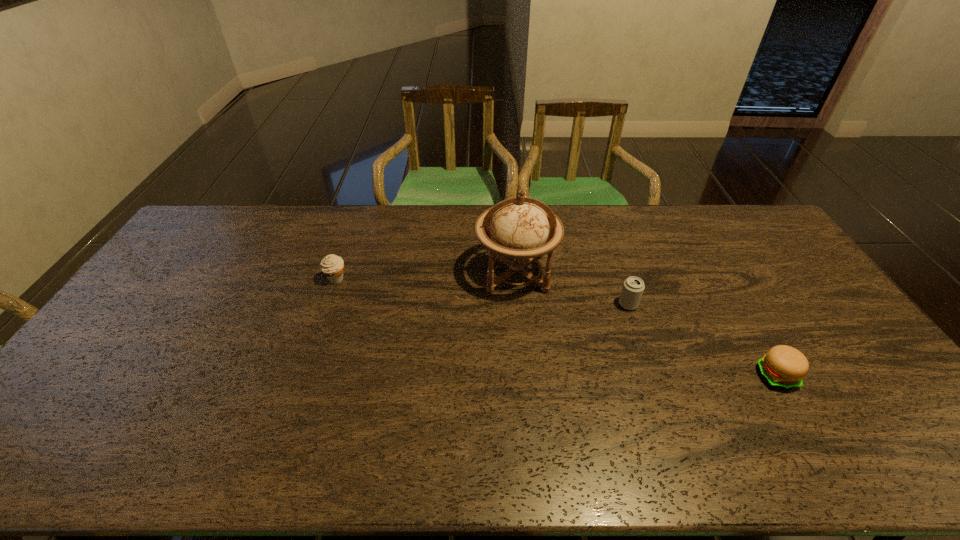
The height and width of the screenshot is (540, 960). I want to click on free space between the globe and the leftmost object, so click(x=426, y=276).

Where is `free space between the can and the tallest object`? The image size is (960, 540). free space between the can and the tallest object is located at coordinates (572, 289).

I want to click on free point between the tallest object and the third object from left to right, so click(572, 289).

Identify the location of empty space between the globe and the can. (572, 289).

Find the location of `free space that is in between the hamburger and the tallest object`. free space that is in between the hamburger and the tallest object is located at coordinates (646, 325).

Find the location of a particular element. This screenshot has width=960, height=540. free space that is in between the leftmost object and the rightmost object is located at coordinates (556, 327).

You are a GUI agent. You are given a task and a screenshot of the screen. Output one action in this format:
    pyautogui.click(x=<x>, y=<y>)
    Task: Click on the object identified as the third closest to the second object from left to right
    This screenshot has height=540, width=960.
    Given the screenshot: What is the action you would take?
    pyautogui.click(x=783, y=366)

At what (x,y) coordinates should I click in order to perform the action: click on object that can be found as the third closest to the leftmost object. Please return your answer as a coordinate pair (x, y). This screenshot has height=540, width=960. Looking at the image, I should click on (783, 366).

Image resolution: width=960 pixels, height=540 pixels. I want to click on vacant region that satisfies the following two spatial constraints: 1. on the front side of the hamburger; 2. on the left side of the can, so click(x=652, y=376).

Where is `vacant area that satisfies the following two spatial constraints: 1. on the front-facing side of the nearest object; 2. on the left side of the tallest object`? This screenshot has height=540, width=960. vacant area that satisfies the following two spatial constraints: 1. on the front-facing side of the nearest object; 2. on the left side of the tallest object is located at coordinates (525, 376).